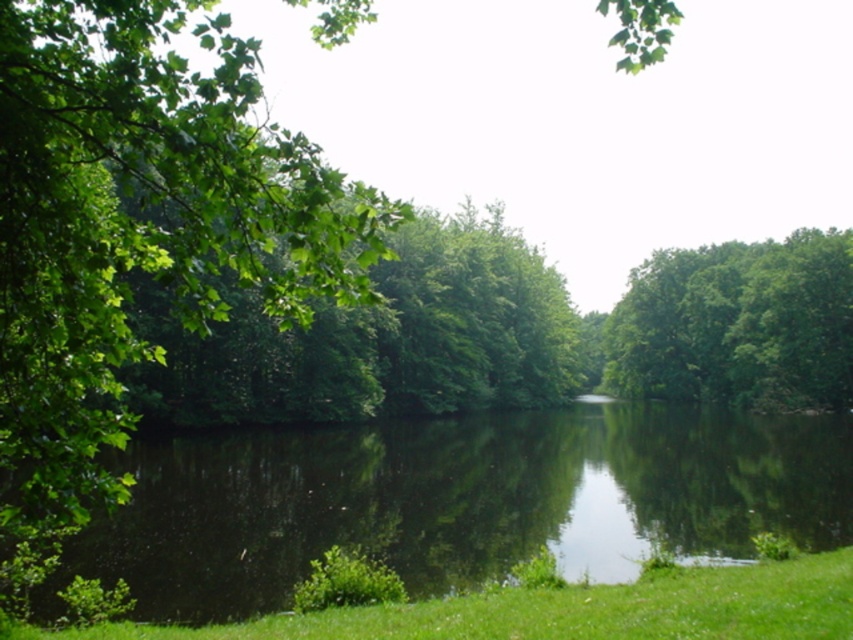
You are standing at the edge of the water in the serene natural scene. You notice two points marked in the image. Which point, point (318, 500) or point (576, 595), is closer to you?

Point (318, 500) is closer to you because it is further to the viewer than point (576, 595).

You are standing at the edge of the scene and want to walk towards the green reflective water at center. Which direction should you move relative to the green grass at lower center?

You should move away from the green grass at lower center because the green reflective water at center is further away from you than the green grass at lower center.

You are standing at the edge of the scene and want to place a small decorative rock. If you place it on the green reflective water at center and the green grass at lower center, which surface will the rock sink into?

The green reflective water at center is taller than the green grass at lower center, so the rock will sink into the green reflective water at center.